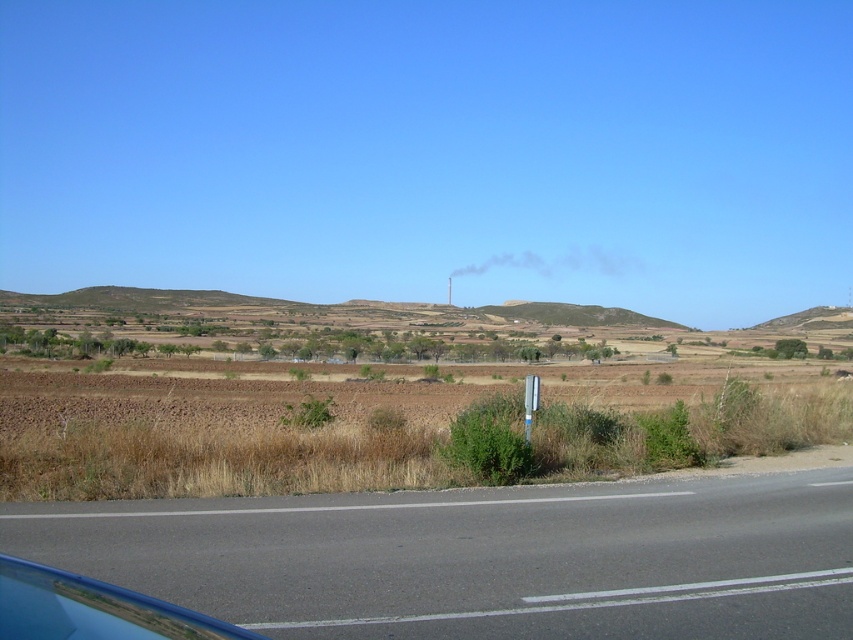
You are driving a car and notice the asphalt road at lower center and the blue glass car window at lower left. Which object is positioned to the right side from your perspective?

The asphalt road at lower center is to the right of blue glass car window at lower left, so the asphalt road at lower center is positioned to the right side from your perspective.